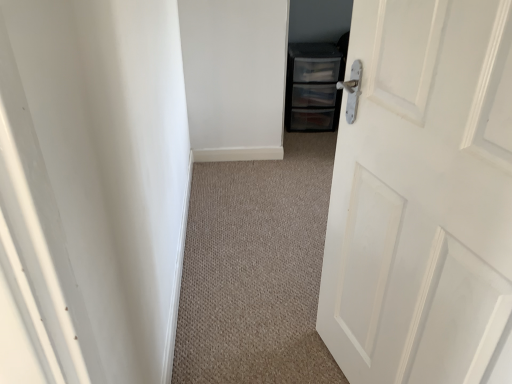
Measure the distance between clear plastic drawers at center and camera.

clear plastic drawers at center is 2.98 meters away from camera.

Measure the distance between point (286, 107) and camera.

They are 2.99 meters apart.

Describe the element at coordinates (312, 87) in the screenshot. I see `clear plastic drawers at center` at that location.

Image resolution: width=512 pixels, height=384 pixels. In order to click on clear plastic drawers at center in this screenshot , I will do [312, 87].

Locate an element on the screen. This screenshot has width=512, height=384. clear plastic drawers at center is located at coordinates (312, 87).